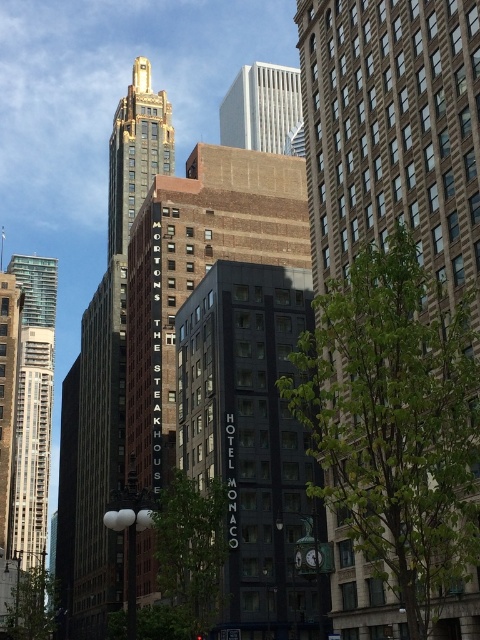
You are a city planner assessing the skyline. Given the brown brick building at center and the shiny gold tower at upper center, which structure would cast a longer shadow during midday in summer?

The shiny gold tower at upper center is taller than the brown brick building at center, so it would cast a longer shadow during midday in summer.

You are a city planner assessing the space between two buildings in the image. The brown brick building at center and the black glass building at center are both part of a proposed renovation. Which building has a narrower width, and would require less space for expansion?

The brown brick building at center is thinner than the black glass building at center, so it has a narrower width and would require less space for expansion.

You are standing on the sidewalk in front of the brown brick building at center and the shiny gold tower at upper center. Which building is closer to you?

The brown brick building at center is closer to you because it is in front of the shiny gold tower at upper center.